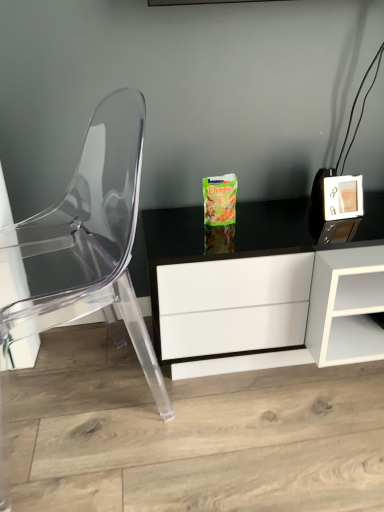
Question: In the image, is green matte snack packet at center on the left side or the right side of transparent plastic chair at left?

Choices:
 (A) right
 (B) left

Answer: (A)

Question: From the image's perspective, relative to transparent plastic chair at left, is green matte snack packet at center above or below?

Choices:
 (A) above
 (B) below

Answer: (B)

Question: From a real-world perspective, is green matte snack packet at center positioned above or below transparent plastic chair at left?

Choices:
 (A) above
 (B) below

Answer: (B)

Question: Considering the positions of transparent plastic chair at left and green matte snack packet at center in the image, is transparent plastic chair at left taller or shorter than green matte snack packet at center?

Choices:
 (A) tall
 (B) short

Answer: (A)

Question: Based on their positions, is transparent plastic chair at left located to the left or right of green matte snack packet at center?

Choices:
 (A) right
 (B) left

Answer: (B)

Question: Does point (158, 389) appear closer or farther from the camera than point (231, 295)?

Choices:
 (A) closer
 (B) farther

Answer: (B)

Question: From a real-world perspective, relative to green matte snack packet at center, is transparent plastic chair at left vertically above or below?

Choices:
 (A) above
 (B) below

Answer: (A)